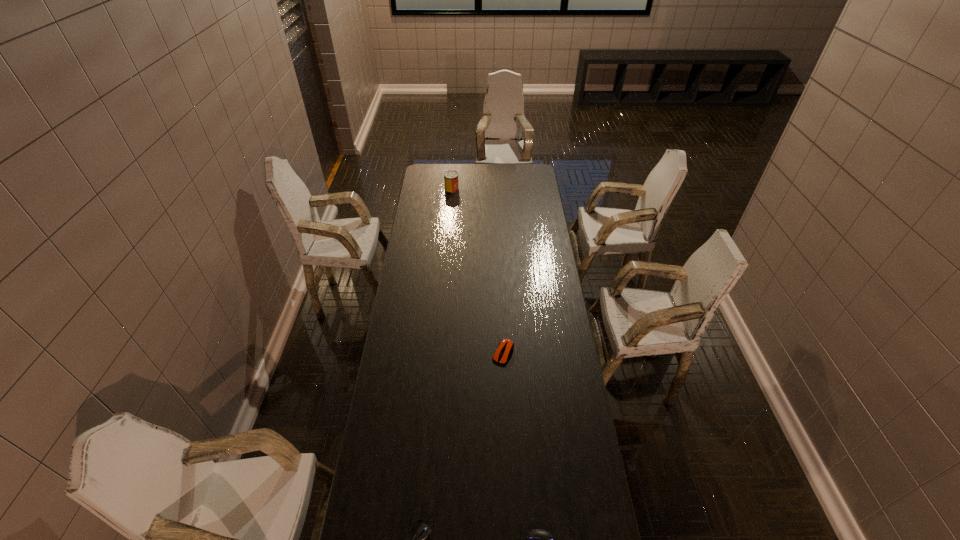
Where is `object that is the second nearest to the can`? This screenshot has width=960, height=540. object that is the second nearest to the can is located at coordinates (424, 531).

Locate an element on the screen. This screenshot has height=540, width=960. object that is the second closest to the shortest computer mouse is located at coordinates (505, 347).

Identify which computer mouse is the closest to the farthest computer mouse. Please provide its 2D coordinates. Your answer should be formatted as a tuple, i.e. [(x, y)], where the tuple contains the x and y coordinates of a point satisfying the conditions above.

[(424, 531)]

Locate which computer mouse ranks second in proximity to the leftmost computer mouse. Please provide its 2D coordinates. Your answer should be formatted as a tuple, i.e. [(x, y)], where the tuple contains the x and y coordinates of a point satisfying the conditions above.

[(505, 347)]